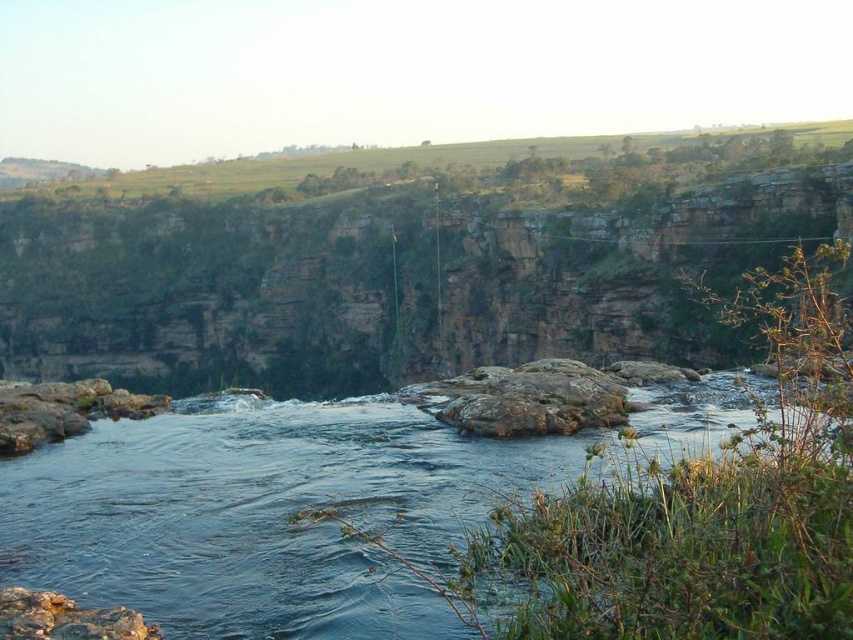
Does point (144, 248) come closer to viewer compared to point (21, 384)?

No.

This screenshot has height=640, width=853. What do you see at coordinates (410, 266) in the screenshot? I see `green grassy hillside at upper center` at bounding box center [410, 266].

You are a GUI agent. You are given a task and a screenshot of the screen. Output one action in this format:
    pyautogui.click(x=<x>, y=<y>)
    Task: Click on the green grassy hillside at upper center
    The image size is (853, 640).
    Given the screenshot: What is the action you would take?
    pyautogui.click(x=410, y=266)

How much distance is there between green grassy hillside at upper center and rusty stone at lower left?

The distance of green grassy hillside at upper center from rusty stone at lower left is 310.84 feet.

Which of these two, green grassy hillside at upper center or rusty stone at lower left, stands taller?

green grassy hillside at upper center

Locate an element on the screen. The height and width of the screenshot is (640, 853). green grassy hillside at upper center is located at coordinates (410, 266).

Can you confirm if clear water at center is positioned to the left of smooth gray rock at lower left?

No, clear water at center is not to the left of smooth gray rock at lower left.

Is the position of clear water at center less distant than that of smooth gray rock at lower left?

Yes, it is.

This screenshot has width=853, height=640. What do you see at coordinates (196, 484) in the screenshot?
I see `clear water at center` at bounding box center [196, 484].

I want to click on clear water at center, so click(196, 484).